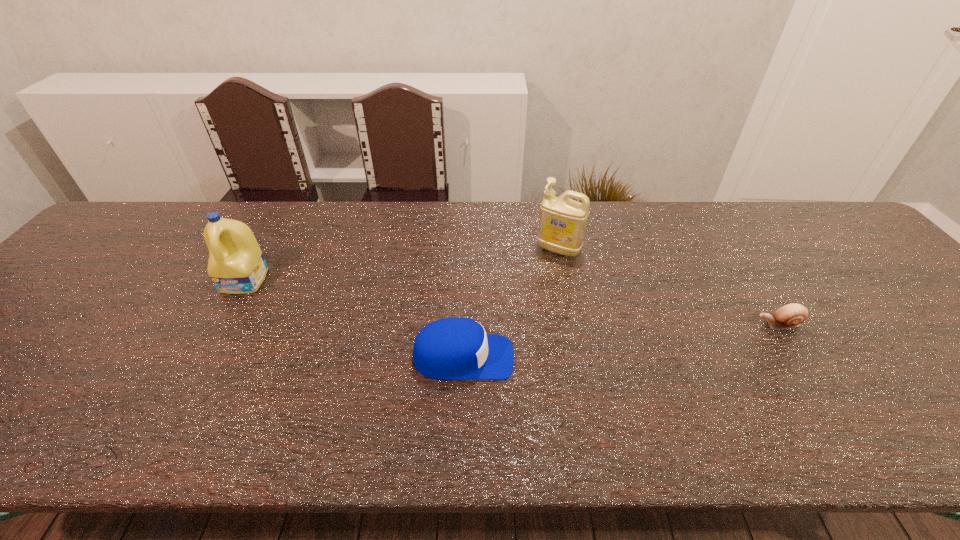
Where is `free space between the nearest object and the shortest object`? free space between the nearest object and the shortest object is located at coordinates (620, 341).

Locate an element on the screen. The height and width of the screenshot is (540, 960). free point between the right detergent and the nearest object is located at coordinates (511, 303).

The image size is (960, 540). Identify the location of free spot between the farthest object and the second shortest object. [511, 303].

The image size is (960, 540). What are the coordinates of `vacant area between the second object from left to right and the left detergent` in the screenshot? It's located at (354, 319).

Find the location of a particular element. empty location between the third object from left to right and the escargot is located at coordinates (668, 287).

This screenshot has height=540, width=960. I want to click on free spot between the left detergent and the right detergent, so click(x=402, y=265).

Locate an element on the screen. free space between the third object from left to right and the escargot is located at coordinates (668, 287).

The image size is (960, 540). Find the location of `blank region between the farther detergent and the left detergent`. blank region between the farther detergent and the left detergent is located at coordinates (402, 265).

Locate which object ranks second in proximity to the farthest object. Please provide its 2D coordinates. Your answer should be formatted as a tuple, i.e. [(x, y)], where the tuple contains the x and y coordinates of a point satisfying the conditions above.

[(789, 316)]

Identify which object is the second closest to the baseball cap. Please provide its 2D coordinates. Your answer should be formatted as a tuple, i.e. [(x, y)], where the tuple contains the x and y coordinates of a point satisfying the conditions above.

[(236, 265)]